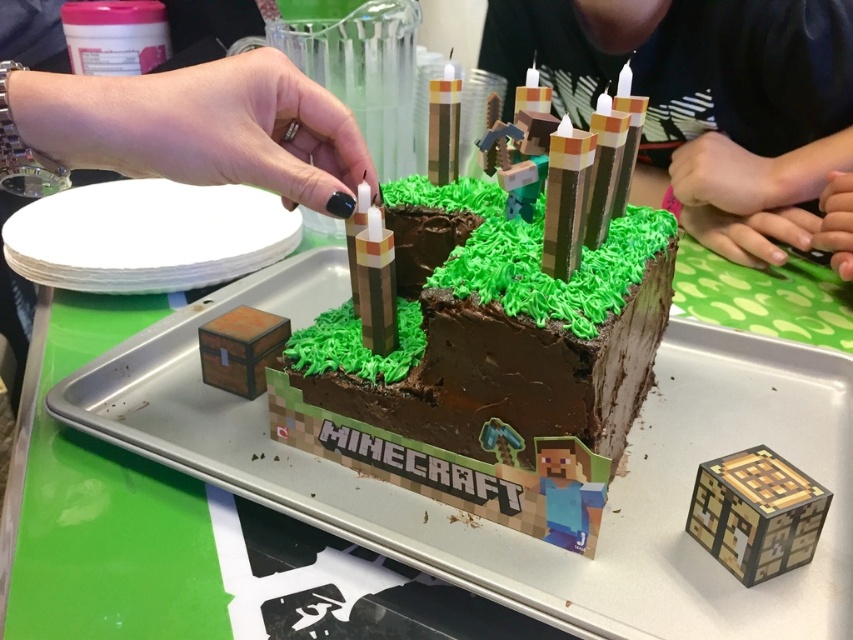
Question: Which object is closer to the camera taking this photo?

Choices:
 (A) chocolate matte block at center
 (B) smooth brown cake at center

Answer: (A)

Question: Does chocolate matte block at center have a smaller size compared to smooth brown cake at center?

Choices:
 (A) yes
 (B) no

Answer: (A)

Question: Does chocolate matte block at center lie behind smooth brown cake at center?

Choices:
 (A) yes
 (B) no

Answer: (B)

Question: Is chocolate matte block at center below smooth brown cake at center?

Choices:
 (A) no
 (B) yes

Answer: (B)

Question: Which point is closer to the camera?

Choices:
 (A) smooth brown cake at center
 (B) chocolate matte block at center

Answer: (B)